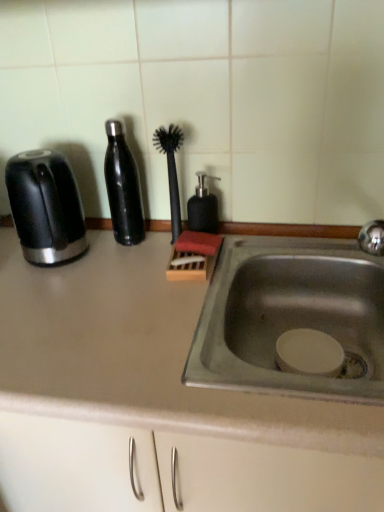
You are a GUI agent. You are given a task and a screenshot of the screen. Output one action in this format:
    pyautogui.click(x=<x>, y=<y>)
    Task: Click on the free space in front of satin black bottle at center left
    This screenshot has height=512, width=384.
    Given the screenshot: What is the action you would take?
    pyautogui.click(x=118, y=278)